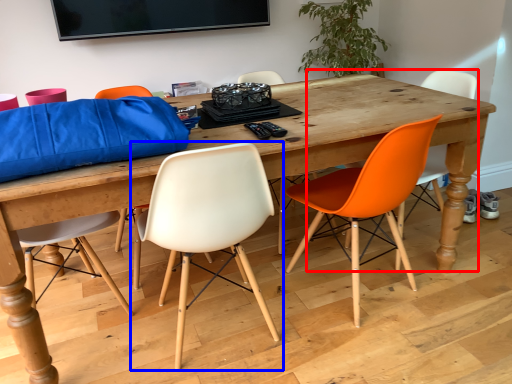
Question: Which point is further to the camera, chair (highlighted by a red box) or chair (highlighted by a blue box)?

Choices:
 (A) chair
 (B) chair

Answer: (A)